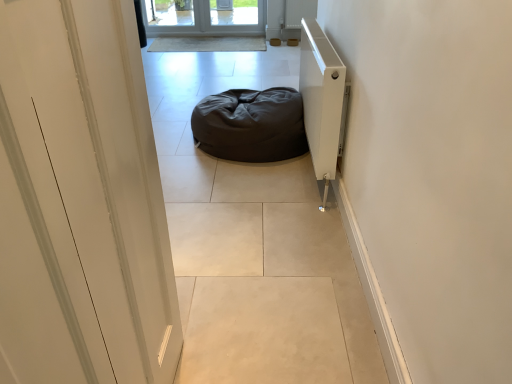
Question: Is dark matte bean bag at center taller than white matte radiator at right?

Choices:
 (A) yes
 (B) no

Answer: (B)

Question: Is dark matte bean bag at center positioned far away from white matte radiator at right?

Choices:
 (A) yes
 (B) no

Answer: (B)

Question: Would you say dark matte bean bag at center contains white matte radiator at right?

Choices:
 (A) yes
 (B) no

Answer: (B)

Question: Is dark matte bean bag at center smaller than white matte radiator at right?

Choices:
 (A) no
 (B) yes

Answer: (A)

Question: Does dark matte bean bag at center have a lesser width compared to white matte radiator at right?

Choices:
 (A) no
 (B) yes

Answer: (A)

Question: Based on their positions, is dark brown fabric bean bag at center located to the left or right of white glossy door at left?

Choices:
 (A) left
 (B) right

Answer: (B)

Question: Is dark brown fabric bean bag at center spatially inside white glossy door at left, or outside of it?

Choices:
 (A) outside
 (B) inside

Answer: (A)

Question: Is dark brown fabric bean bag at center in front of or behind white glossy door at left in the image?

Choices:
 (A) behind
 (B) front

Answer: (A)

Question: Is point (275, 145) positioned closer to the camera than point (5, 49)?

Choices:
 (A) closer
 (B) farther

Answer: (B)

Question: Considering the positions of white matte radiator at right and dark brown fabric bean bag at center in the image, is white matte radiator at right bigger or smaller than dark brown fabric bean bag at center?

Choices:
 (A) big
 (B) small

Answer: (B)

Question: Does point (302, 56) appear closer or farther from the camera than point (252, 160)?

Choices:
 (A) farther
 (B) closer

Answer: (A)

Question: From the image's perspective, is white matte radiator at right located above or below dark brown fabric bean bag at center?

Choices:
 (A) below
 (B) above

Answer: (A)

Question: From their relative heights in the image, would you say white matte radiator at right is taller or shorter than dark brown fabric bean bag at center?

Choices:
 (A) tall
 (B) short

Answer: (A)

Question: Is point (215, 258) closer or farther from the camera than point (280, 109)?

Choices:
 (A) closer
 (B) farther

Answer: (A)

Question: Is dark matte bean bag at center situated inside dark brown fabric bean bag at center or outside?

Choices:
 (A) outside
 (B) inside

Answer: (A)